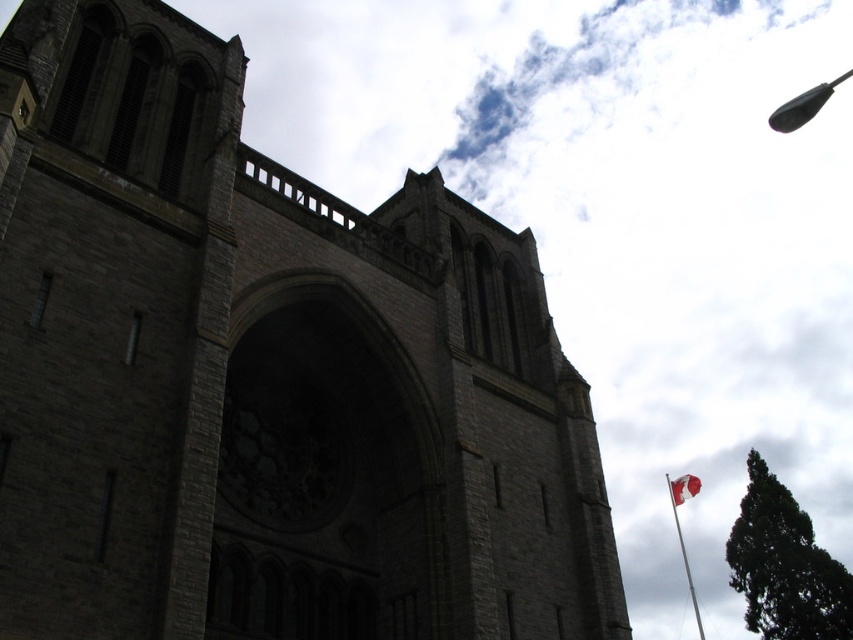
Between metallic flagpole at upper right and white fabric flag at lower right, which one has less height?

white fabric flag at lower right is shorter.

Who is higher up, metallic flagpole at upper right or white fabric flag at lower right?

white fabric flag at lower right

The image size is (853, 640). Describe the element at coordinates (680, 529) in the screenshot. I see `metallic flagpole at upper right` at that location.

Identify the location of metallic flagpole at upper right. (680, 529).

Based on the photo, which of these two, black plastic antenna at upper right or white fabric flag at lower right, stands shorter?

white fabric flag at lower right

Is point (784, 113) behind point (682, 480)?

No.

Locate an element on the screen. black plastic antenna at upper right is located at coordinates (804, 106).

Is dark gray stone church at center to the right of white fabric flag at lower right from the viewer's perspective?

No, dark gray stone church at center is not to the right of white fabric flag at lower right.

Between point (68, 22) and point (676, 493), which one is positioned behind?

The point (676, 493) is more distant.

Identify the location of dark gray stone church at center. tap(265, 376).